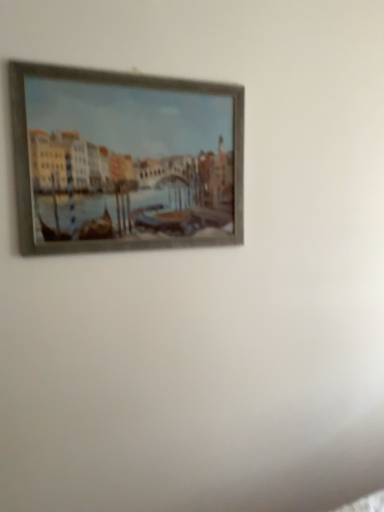
Question: Should I look upward or downward to see wooden frame painting at upper center?

Choices:
 (A) down
 (B) up

Answer: (B)